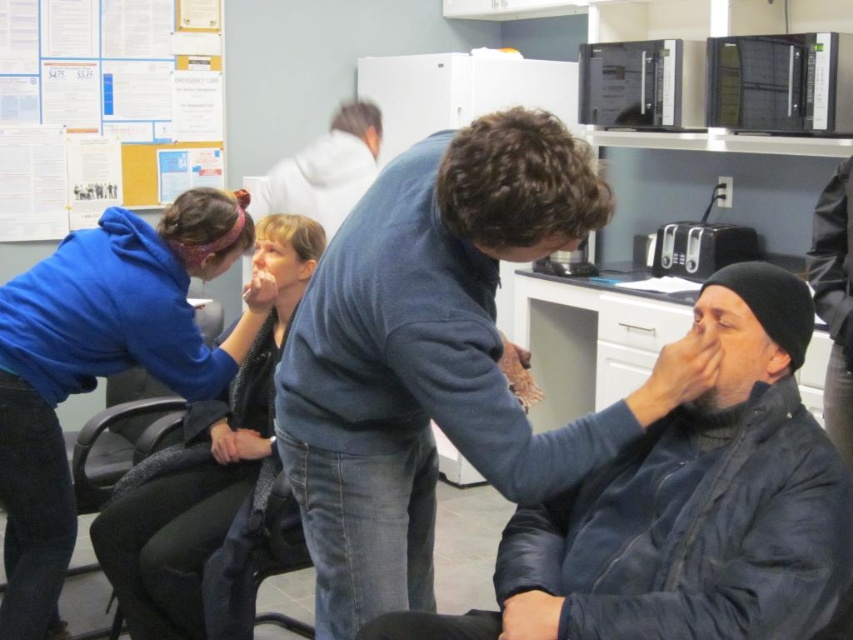
You are standing in the break room and need to reach both the refrigerator and the microwave. The refrigerator is located at point (325, 541) and the microwave at point (152, 460). Which appliance is closer to you?

The refrigerator at point (325, 541) is closer to you since it is nearer to the camera compared to the microwave at point (152, 460).

You are a healthcare worker in this break room and need to access the refrigerator. There is a dark blue leather jacket at center and a dark blue jacket at lower right blocking the path. Which jacket should you move to reach the refrigerator first?

The dark blue leather jacket at center is in front of the dark blue jacket at lower right. To reach the refrigerator first, you should move the dark blue leather jacket at center since it is closer to you and blocking the path directly.

You are standing in a medical clinic break room and see a point marked at coordinates (438, 356). Which object is this point located on?

The point is located on the dark blue leather jacket at center.